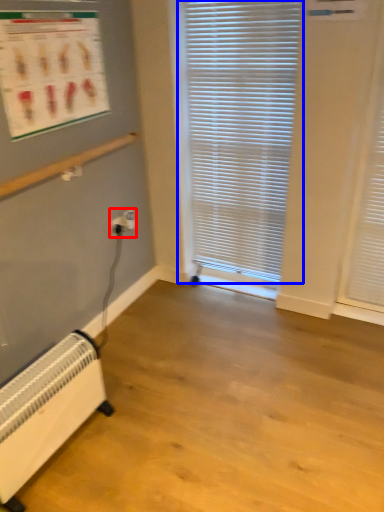
Question: Which of the following is the closest to the observer, electric outlet (highlighted by a red box) or window blind (highlighted by a blue box)?

Choices:
 (A) electric outlet
 (B) window blind

Answer: (B)